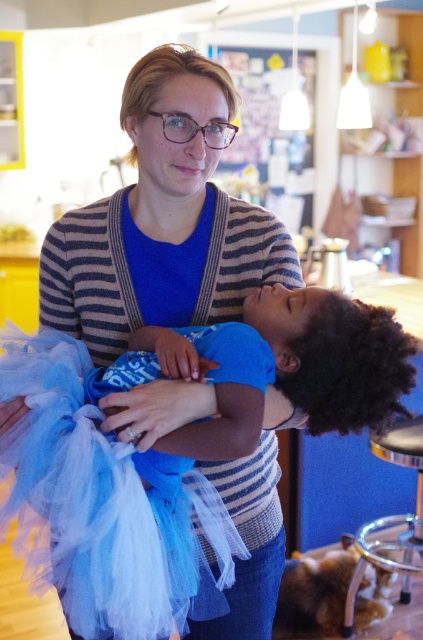
Question: Does blue tulle dress at center have a smaller size compared to metallic silver stool at lower right?

Choices:
 (A) yes
 (B) no

Answer: (A)

Question: Which object is farther from the camera taking this photo?

Choices:
 (A) striped sweater at center
 (B) blue tulle dress at center

Answer: (A)

Question: Is blue tulle dress at center further to camera compared to metallic silver stool at lower right?

Choices:
 (A) yes
 (B) no

Answer: (B)

Question: Which object is the closest to the striped sweater at center?

Choices:
 (A) metallic silver stool at lower right
 (B) blue tulle dress at center

Answer: (B)

Question: Which is farther from the metallic silver stool at lower right?

Choices:
 (A) striped sweater at center
 (B) blue tulle dress at center

Answer: (A)

Question: Is striped sweater at center closer to the viewer compared to blue tulle dress at center?

Choices:
 (A) yes
 (B) no

Answer: (B)